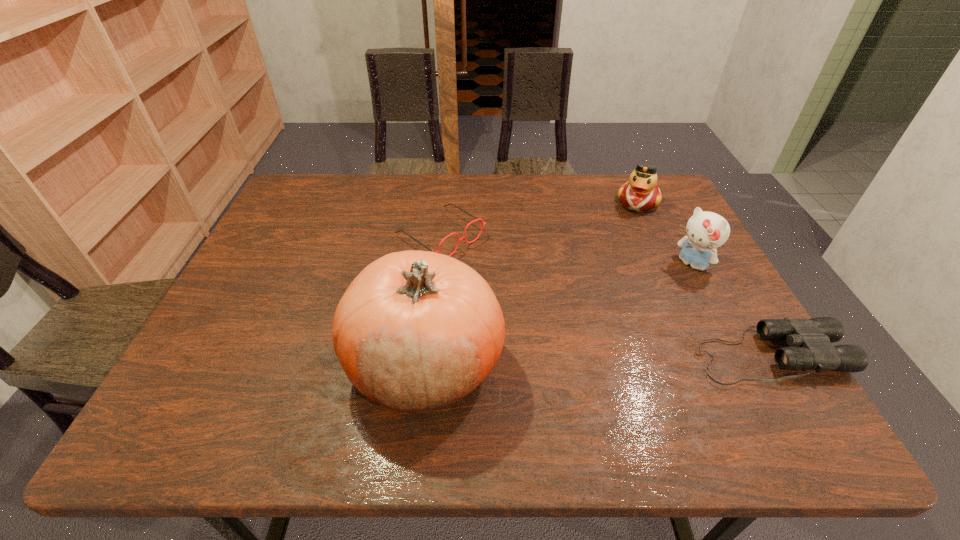
Where is `free spot located on the front-facing side of the kitten`? free spot located on the front-facing side of the kitten is located at coordinates (635, 309).

Where is `free space located 0.280m on the front-facing side of the kitten`? This screenshot has width=960, height=540. free space located 0.280m on the front-facing side of the kitten is located at coordinates (611, 328).

Locate an element on the screen. free region located 0.290m on the face of the duck is located at coordinates (615, 274).

Locate an element on the screen. The image size is (960, 540). vacant space located 0.050m on the face of the duck is located at coordinates (632, 224).

The width and height of the screenshot is (960, 540). Find the location of `vacant space situated 0.310m on the face of the duck`. vacant space situated 0.310m on the face of the duck is located at coordinates (613, 279).

The image size is (960, 540). What are the coordinates of `spectacles that is positioned at the far edge` in the screenshot? It's located at (464, 238).

Locate an element on the screen. duck present at the far edge is located at coordinates pyautogui.click(x=641, y=193).

Identify the location of pumpkin at the near edge. click(x=416, y=330).

Identify the location of binoculars positioned at the near edge. The height and width of the screenshot is (540, 960). (811, 339).

Where is `binoculars at the right edge`? binoculars at the right edge is located at coordinates (811, 339).